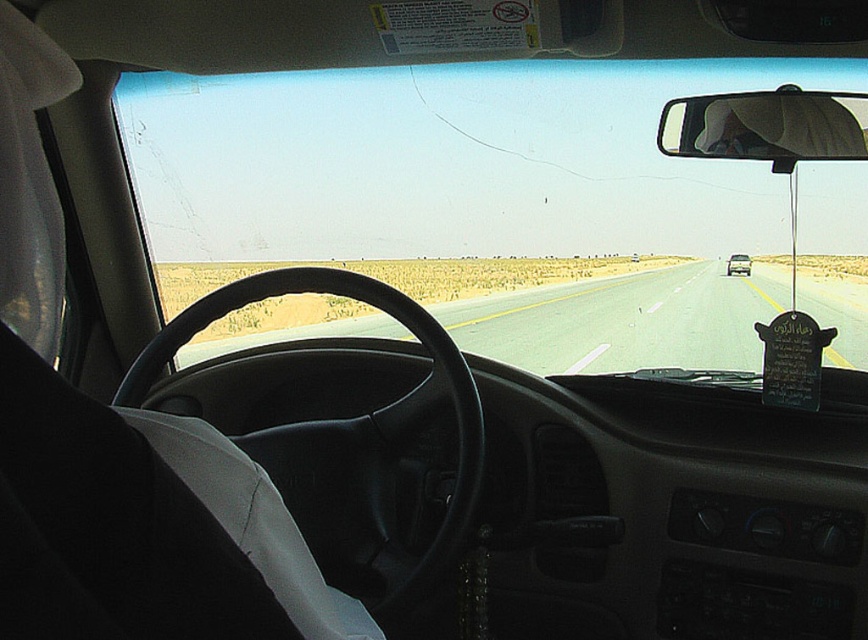
Between point (286, 168) and point (737, 253), which one is positioned in front?

Positioned in front is point (286, 168).

Is transparent glass windshield at center above white glossy sedan at center?

Indeed, transparent glass windshield at center is positioned over white glossy sedan at center.

Between point (714, 193) and point (725, 269), which one is positioned in front?

Point (714, 193) is in front.

This screenshot has height=640, width=868. I want to click on transparent glass windshield at center, so click(479, 200).

Does transparent glass windshield at center appear over matte black rearview mirror at upper right?

Yes, transparent glass windshield at center is above matte black rearview mirror at upper right.

Does transparent glass windshield at center have a larger size compared to matte black rearview mirror at upper right?

Correct, transparent glass windshield at center is larger in size than matte black rearview mirror at upper right.

Who is more distant from viewer, (648,102) or (860,118)?

Point (648,102)

Find the location of a particular element. transparent glass windshield at center is located at coordinates (479, 200).

Does matte black rearview mirror at upper right have a lesser height compared to white glossy sedan at center?

Yes.

Does matte black rearview mirror at upper right lie behind white glossy sedan at center?

No, matte black rearview mirror at upper right is closer to the viewer.

The width and height of the screenshot is (868, 640). What are the coordinates of `matte black rearview mirror at upper right` in the screenshot? It's located at (766, 125).

Locate an element on the screen. matte black rearview mirror at upper right is located at coordinates (766, 125).